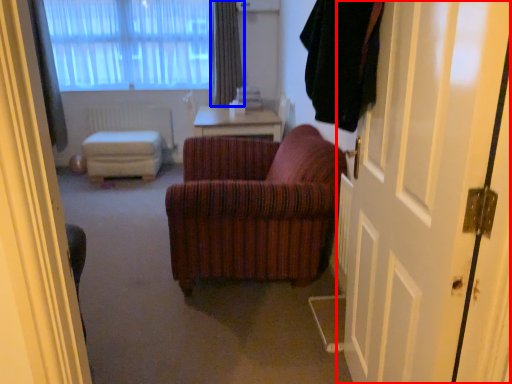
Question: Which of the following is the closest to the observer, door (highlighted by a red box) or curtain (highlighted by a blue box)?

Choices:
 (A) door
 (B) curtain

Answer: (A)